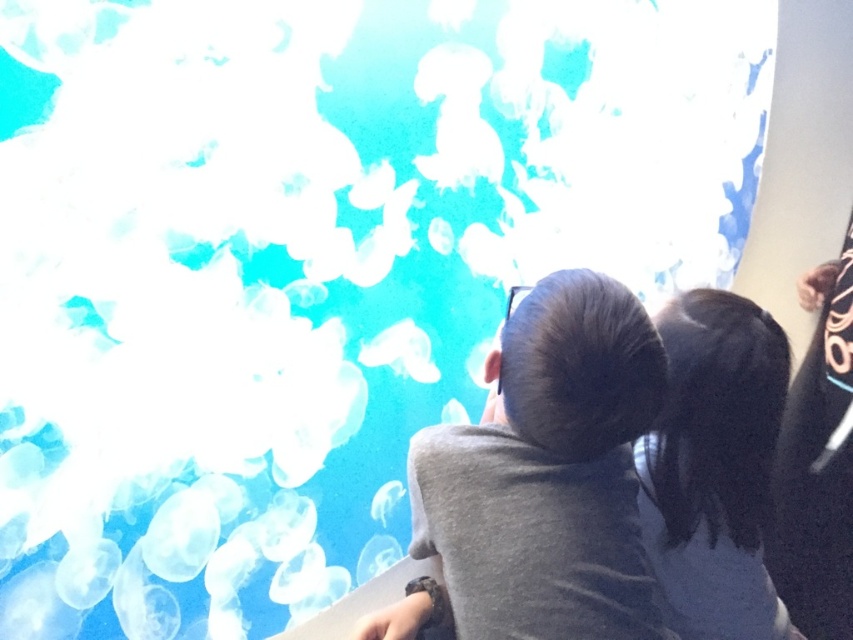
Question: Does gray matte shirt at center lie behind black hair at upper right?

Choices:
 (A) no
 (B) yes

Answer: (A)

Question: Can you confirm if gray matte shirt at center is positioned above black hair at upper right?

Choices:
 (A) no
 (B) yes

Answer: (A)

Question: Which of the following is the closest to the observer?

Choices:
 (A) gray matte shirt at center
 (B) black hair at upper right

Answer: (A)

Question: Is gray matte shirt at center behind black hair at upper right?

Choices:
 (A) yes
 (B) no

Answer: (B)

Question: Which of the following is the closest to the observer?

Choices:
 (A) (461, 628)
 (B) (712, 332)

Answer: (A)